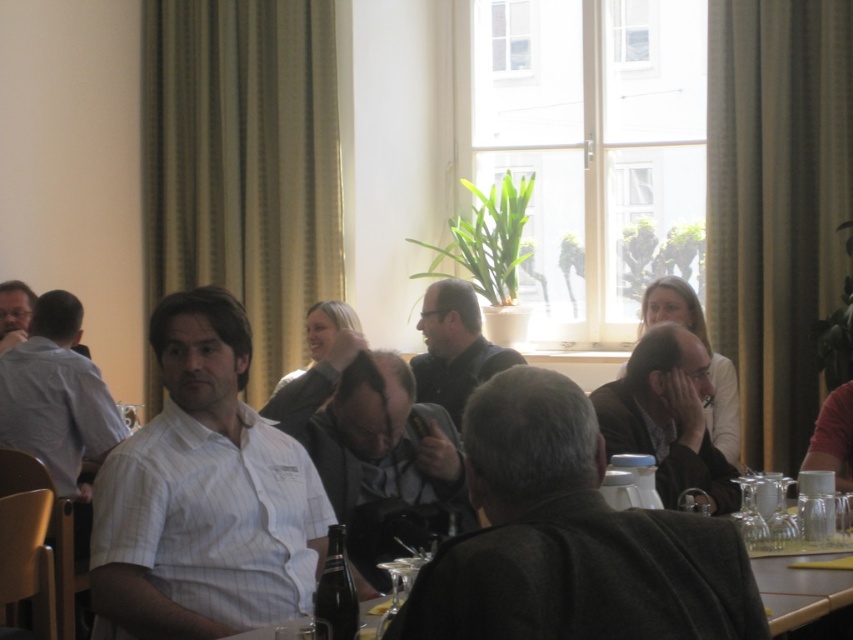
Question: Which object is the farthest from the clear glassware at center?

Choices:
 (A) dark brown leather jacket at center
 (B) dark gray fabric jacket at center
 (C) green textured curtain at upper left
 (D) white striped shirt at center

Answer: (C)

Question: Which of these objects is positioned closest to the green textured curtain at upper left?

Choices:
 (A) clear glassware at center
 (B) dark gray fabric jacket at center

Answer: (A)

Question: Does green textured curtain at upper left appear over dark gray fabric jacket at center?

Choices:
 (A) yes
 (B) no

Answer: (A)

Question: Is green textured curtain at upper left positioned in front of dark gray fabric jacket at center?

Choices:
 (A) no
 (B) yes

Answer: (A)

Question: Which of the following is the closest to the observer?

Choices:
 (A) (460, 602)
 (B) (686, 339)
 (C) (149, 218)
 (D) (770, 264)

Answer: (A)

Question: Does green textured curtain at upper left have a smaller size compared to clear glassware at center?

Choices:
 (A) yes
 (B) no

Answer: (B)